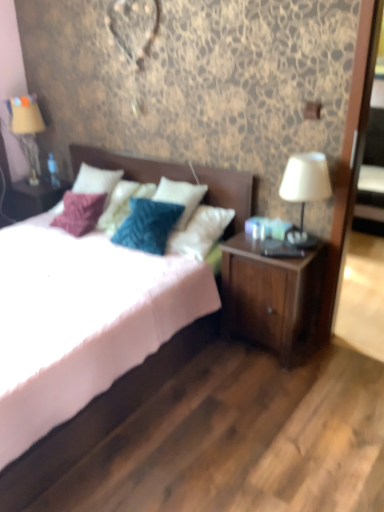
Question: Considering their positions, is white fabric lampshade at right, the 2th table lamp from the left, located in front of or behind wooden nightstand at lower right?

Choices:
 (A) front
 (B) behind

Answer: (A)

Question: Is white fabric lampshade at right, the 1th table lamp positioned from the right, to the left or to the right of wooden nightstand at lower right in the image?

Choices:
 (A) right
 (B) left

Answer: (A)

Question: Which is farther from the white matte bed at center?

Choices:
 (A) white fabric lampshade at right, the 1th table lamp positioned from the right
 (B) wooden nightstand at lower right
 (C) matte beige fabric at left, which is counted as the 2th table lamp, starting from the front

Answer: (C)

Question: Which of these objects is positioned farthest from the white fabric lampshade at right, which is counted as the second table lamp, starting from the back?

Choices:
 (A) wooden nightstand at lower right
 (B) matte beige fabric at left, marked as the 1th table lamp in a back-to-front arrangement
 (C) white matte bed at center

Answer: (B)